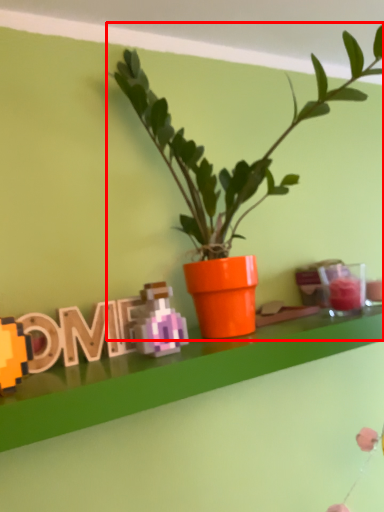
Question: Observing the image, what is the correct spatial positioning of houseplant (annotated by the red box) in reference to alphabet?

Choices:
 (A) right
 (B) left

Answer: (A)